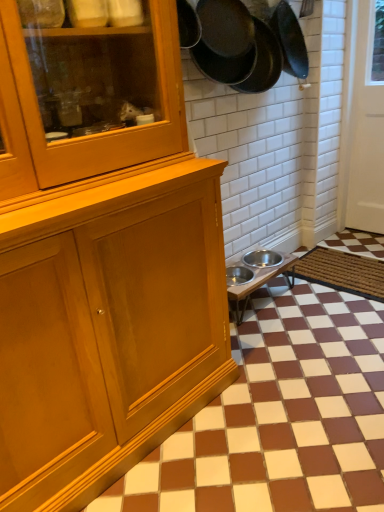
Question: Is brown woven mat at lower right behind dark gray matte frying pan at upper right, arranged as the second frying pan when viewed from the left?

Choices:
 (A) no
 (B) yes

Answer: (B)

Question: Are brown woven mat at lower right and dark gray matte frying pan at upper right, arranged as the second frying pan when viewed from the left, far apart?

Choices:
 (A) no
 (B) yes

Answer: (B)

Question: Is brown woven mat at lower right with dark gray matte frying pan at upper right, arranged as the second frying pan when viewed from the left?

Choices:
 (A) no
 (B) yes

Answer: (A)

Question: Is brown woven mat at lower right smaller than dark gray matte frying pan at upper right, arranged as the second frying pan when viewed from the left?

Choices:
 (A) no
 (B) yes

Answer: (B)

Question: Does brown woven mat at lower right turn towards dark gray matte frying pan at upper right, arranged as the second frying pan when viewed from the left?

Choices:
 (A) no
 (B) yes

Answer: (A)

Question: From their relative heights in the image, would you say metallic stainless steel bowls at lower right is taller or shorter than black matte frying pan at upper right, which ranks as the second frying pan in right-to-left order?

Choices:
 (A) tall
 (B) short

Answer: (B)

Question: Based on their positions, is metallic stainless steel bowls at lower right located to the left or right of black matte frying pan at upper right, placed as the first frying pan when sorted from left to right?

Choices:
 (A) right
 (B) left

Answer: (A)

Question: Is metallic stainless steel bowls at lower right inside the boundaries of black matte frying pan at upper right, placed as the first frying pan when sorted from left to right, or outside?

Choices:
 (A) outside
 (B) inside

Answer: (A)

Question: Is metallic stainless steel bowls at lower right in front of or behind black matte frying pan at upper right, placed as the first frying pan when sorted from left to right, in the image?

Choices:
 (A) behind
 (B) front

Answer: (A)

Question: From a real-world perspective, relative to black matte frying pan at upper right, which ranks as the second frying pan in right-to-left order, is brown matte tile at lower right vertically above or below?

Choices:
 (A) above
 (B) below

Answer: (B)

Question: Considering the positions of point (263, 339) and point (233, 38), is point (263, 339) closer or farther from the camera than point (233, 38)?

Choices:
 (A) closer
 (B) farther

Answer: (B)

Question: Would you say brown matte tile at lower right is to the left or to the right of black matte frying pan at upper right, which ranks as the second frying pan in right-to-left order, in the picture?

Choices:
 (A) right
 (B) left

Answer: (A)

Question: Would you say brown matte tile at lower right is inside or outside black matte frying pan at upper right, placed as the first frying pan when sorted from left to right?

Choices:
 (A) inside
 (B) outside

Answer: (B)

Question: Is point (221, 57) positioned closer to the camera than point (380, 321)?

Choices:
 (A) closer
 (B) farther

Answer: (A)

Question: Considering the positions of black matte frying pan at upper right, which ranks as the second frying pan in right-to-left order, and brown matte tile at lower right in the image, is black matte frying pan at upper right, which ranks as the second frying pan in right-to-left order, wider or thinner than brown matte tile at lower right?

Choices:
 (A) thin
 (B) wide

Answer: (A)